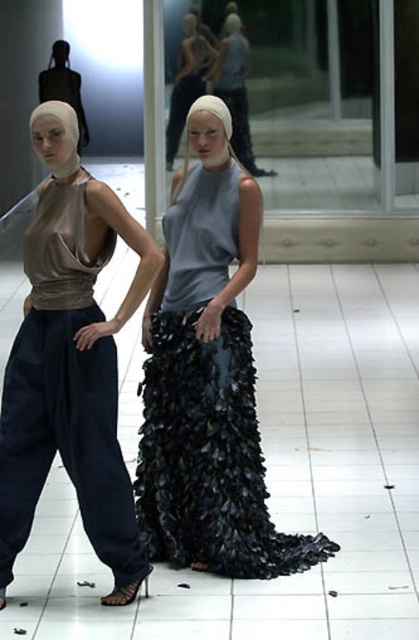
Question: Which is nearer to the matte brown fabric top at left?

Choices:
 (A) matte gray dress at center
 (B) shiny black fabric dress at center

Answer: (B)

Question: Which point appears closest to the camera in this image?

Choices:
 (A) (201, 90)
 (B) (18, 378)
 (C) (214, 388)

Answer: (B)

Question: Can you confirm if shiny black fabric dress at center is positioned below matte gray dress at center?

Choices:
 (A) no
 (B) yes

Answer: (B)

Question: Does matte brown fabric top at left have a smaller size compared to matte gray dress at center?

Choices:
 (A) no
 (B) yes

Answer: (A)

Question: Which point appears closest to the camera in this image?

Choices:
 (A) [87, 332]
 (B) [186, 102]

Answer: (A)

Question: Can you confirm if shiny black fabric dress at center is positioned to the left of matte brown fabric top at left?

Choices:
 (A) yes
 (B) no

Answer: (B)